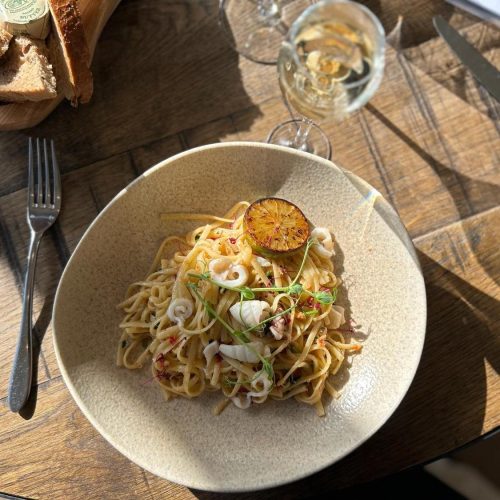
Locate an element on the screen. The height and width of the screenshot is (500, 500). stem of wineglass is located at coordinates (306, 128).